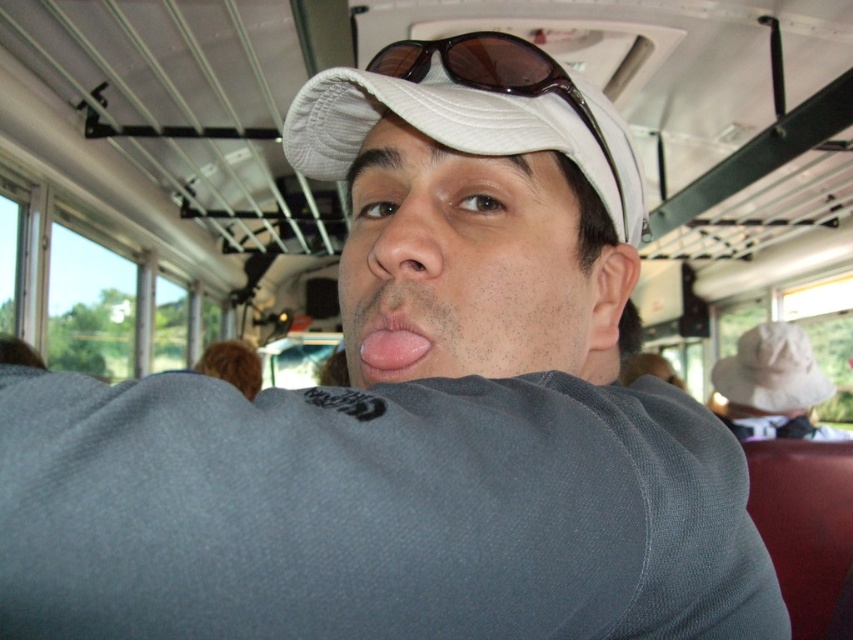
You are a photographer trying to capture the best shot of the matte gray face at center and the pink flesh at center. Which one should you focus on to ensure the subject is in sharp focus?

The matte gray face at center is positioned over the pink flesh at center, so focusing on the matte gray face at center will ensure the subject is in sharp focus.

You are a photographer trying to capture a candid shot of the matte gray face at center and the white fabric cap at center. If you want to ensure both subjects are in focus, which one should you adjust your camera focus on first considering their sizes?

The matte gray face at center has a lesser width compared to white fabric cap at center, so you should focus on the smaller matte gray face at center first to ensure both are in focus.

You are a photographer on the bus and want to take a closeup shot of the person taking a selfie. The camera you have can only focus on objects within 2 inches of the lens. If you are positioned directly in front of the person, will the camera focus on the white fabric cap at center or the matte skin nose at center?

The distance between the white fabric cap at center and the matte skin nose at center is 2.85 inches. Since the camera can only focus on objects within 2 inches, it cannot focus on both simultaneously. The camera will focus on whichever object is closer to the lens. However, the description does not specify which is closer, so the focus cannot be determined with the given information.